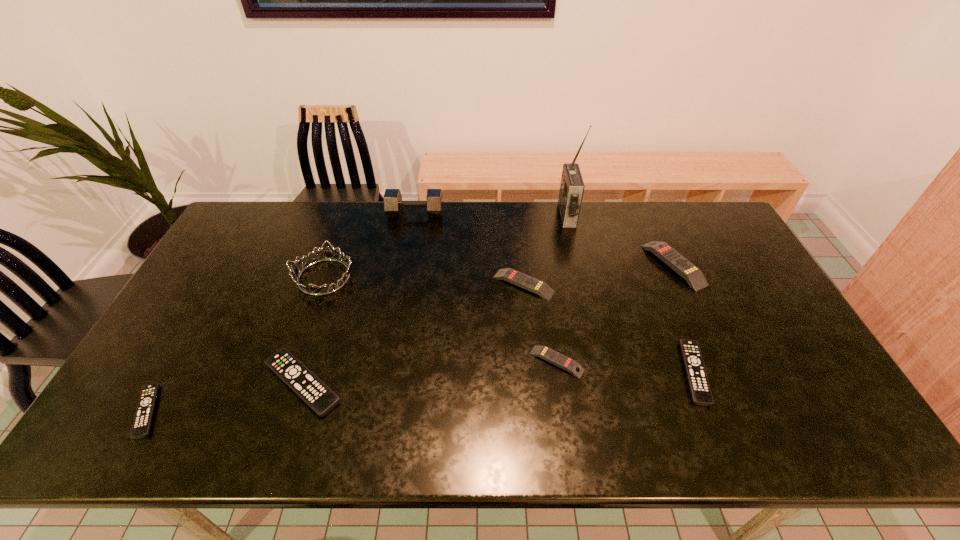
What are the coordinates of `the tallest object` in the screenshot? It's located at (571, 191).

At what (x,y) coordinates should I click in order to perform the action: click on the third object from right to left. Please return your answer as a coordinate pair (x, y). This screenshot has height=540, width=960. Looking at the image, I should click on (571, 191).

Where is `dumbbell`? dumbbell is located at coordinates (393, 204).

Identify the location of the fourth object from left to right. The image size is (960, 540). (393, 204).

The height and width of the screenshot is (540, 960). I want to click on the seventh shortest object, so click(327, 254).

I want to click on the rightmost yellow remote control, so click(x=693, y=275).

You are a GUI agent. You are given a task and a screenshot of the screen. Output one action in this format:
    pyautogui.click(x=<x>, y=<y>)
    Task: Click on the sixth shortest object
    The image size is (960, 540).
    Given the screenshot: What is the action you would take?
    pyautogui.click(x=693, y=275)

Where is `the second biggest yellow remote control`? the second biggest yellow remote control is located at coordinates (539, 287).

At what (x,y) coordinates should I click in order to perform the action: click on the biggest black remote control. Please return your answer as a coordinate pair (x, y). The image size is (960, 540). Looking at the image, I should click on pyautogui.click(x=315, y=393).

Identify the location of the second black remote control from right to left. This screenshot has height=540, width=960. (315, 393).